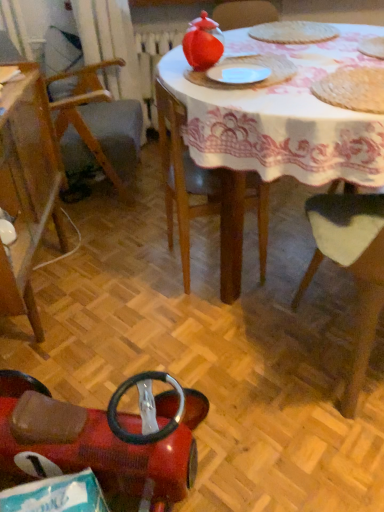
Locate an element on the screen. The height and width of the screenshot is (512, 384). empty space that is in between woven mat at upper right, which is the 1th food from front to back, and white textured placemat at upper center, positioned as the 1th food in top-to-bottom order is located at coordinates (321, 59).